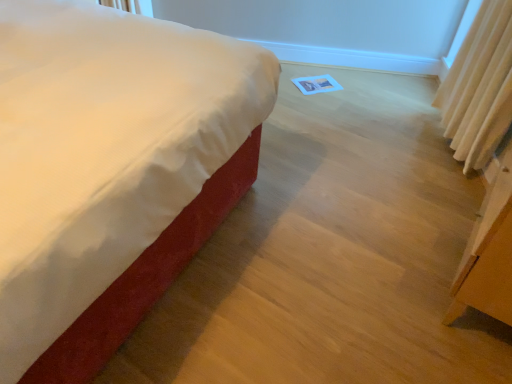
The height and width of the screenshot is (384, 512). Identify the location of empty space that is to the right of satin white bed at center. (342, 229).